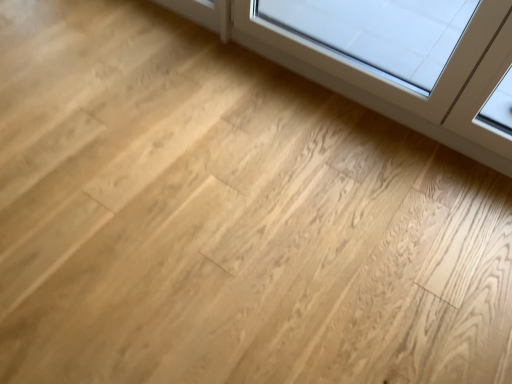
At what (x,y) coordinates should I click in order to perform the action: click on transparent glass window at upper right. Please return your answer as a coordinate pair (x, y). This screenshot has width=512, height=384. Looking at the image, I should click on (349, 86).

What do you see at coordinates (349, 86) in the screenshot?
I see `transparent glass window at upper right` at bounding box center [349, 86].

Locate an element on the screen. This screenshot has height=384, width=512. transparent glass window at upper right is located at coordinates (349, 86).